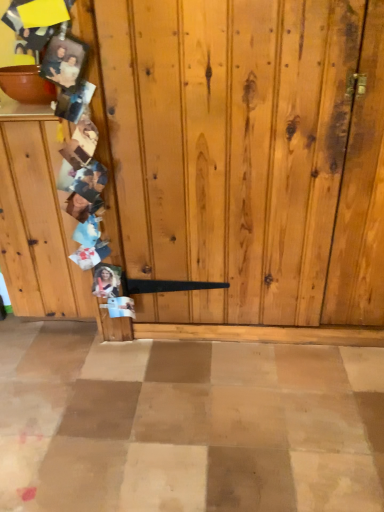
Question: From the image's perspective, is matte brown bowl at upper left positioned above or below wooden photo collage at left?

Choices:
 (A) above
 (B) below

Answer: (A)

Question: In terms of height, does matte brown bowl at upper left look taller or shorter compared to wooden photo collage at left?

Choices:
 (A) tall
 (B) short

Answer: (B)

Question: Is matte brown bowl at upper left bigger or smaller than wooden photo collage at left?

Choices:
 (A) small
 (B) big

Answer: (A)

Question: From the image's perspective, is wooden photo collage at left located above or below matte brown bowl at upper left?

Choices:
 (A) above
 (B) below

Answer: (B)

Question: Do you think wooden photo collage at left is within matte brown bowl at upper left, or outside of it?

Choices:
 (A) outside
 (B) inside

Answer: (A)

Question: Looking at the image, does wooden photo collage at left seem bigger or smaller compared to matte brown bowl at upper left?

Choices:
 (A) big
 (B) small

Answer: (A)

Question: Looking at their shapes, would you say wooden photo collage at left is wider or thinner than matte brown bowl at upper left?

Choices:
 (A) thin
 (B) wide

Answer: (B)